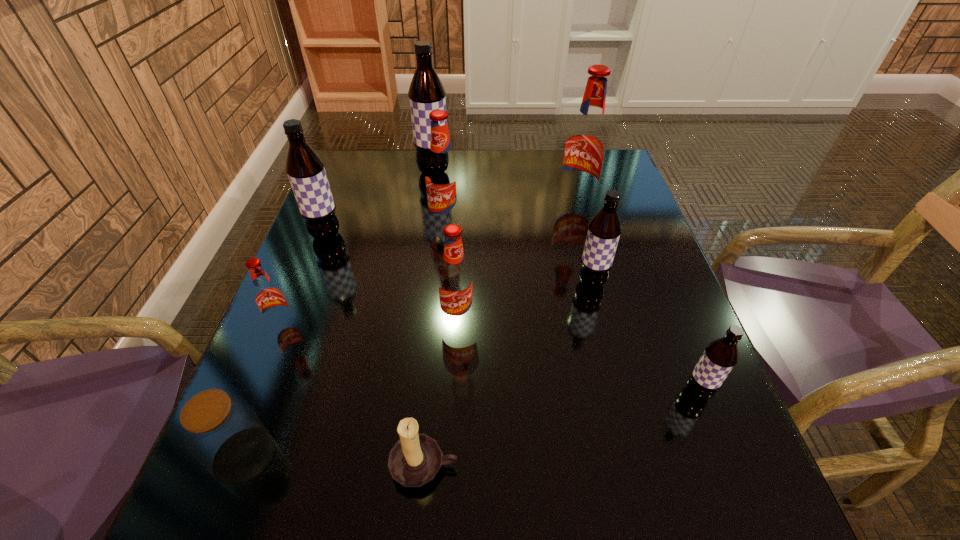
The width and height of the screenshot is (960, 540). Identify the location of the farthest root beer. (426, 93).

You are a GUI agent. You are given a task and a screenshot of the screen. Output one action in this format:
    pyautogui.click(x=<x>, y=<y>)
    Task: Click on the farthest brown root beer
    
    Given the screenshot: What is the action you would take?
    pyautogui.click(x=426, y=93)

This screenshot has height=540, width=960. I want to click on the second farthest object, so click(x=586, y=143).

Find the location of a particular element. Image resolution: width=960 pixels, height=540 pixels. the farthest red root beer is located at coordinates (586, 143).

Identify the location of the second biggest red root beer. This screenshot has width=960, height=540. coord(442,175).

Find the location of `the third smallest brown root beer`. the third smallest brown root beer is located at coordinates (305, 169).

Find the location of a particular element. The height and width of the screenshot is (540, 960). the leftmost brown root beer is located at coordinates (305, 169).

Locate an element on the screen. This screenshot has width=960, height=540. the fifth farthest object is located at coordinates (604, 230).

The height and width of the screenshot is (540, 960). In order to click on the fifth farthest root beer in this screenshot , I will do `click(604, 230)`.

At what (x,y) coordinates should I click in order to perform the action: click on the second smallest red root beer. Please return your answer as a coordinate pair (x, y). The image size is (960, 540). Looking at the image, I should click on (455, 284).